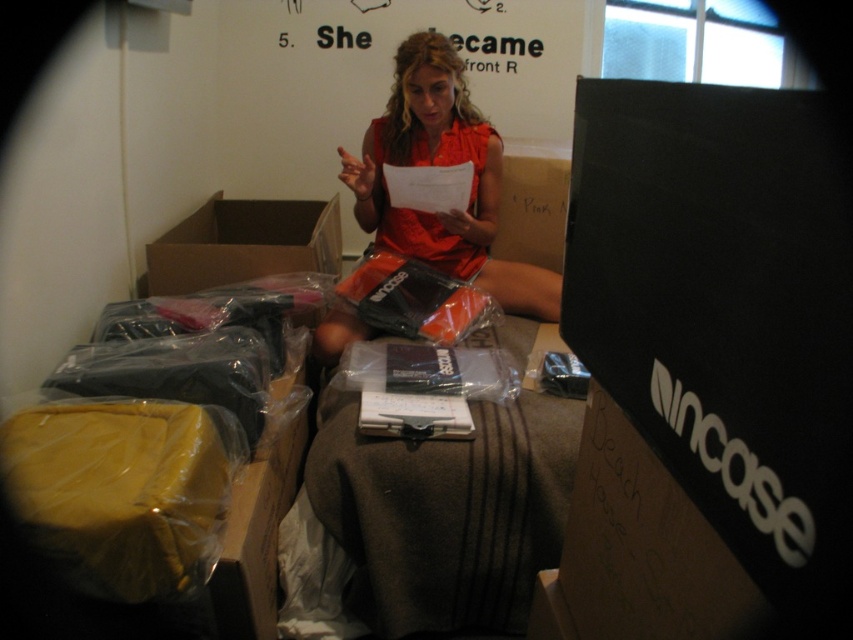
Question: Considering the relative positions of orange matte dress at center and brown cardboard box at upper left in the image provided, where is orange matte dress at center located with respect to brown cardboard box at upper left?

Choices:
 (A) below
 (B) above

Answer: (B)

Question: Which object is closer to the camera taking this photo?

Choices:
 (A) brown cardboard box at upper left
 (B) orange matte dress at center

Answer: (B)

Question: Does orange matte dress at center appear on the right side of brown cardboard box at upper left?

Choices:
 (A) yes
 (B) no

Answer: (A)

Question: Which of the following is the farthest from the observer?

Choices:
 (A) orange matte dress at center
 (B) brown cardboard box at upper left

Answer: (B)

Question: Which of the following is the closest to the observer?

Choices:
 (A) orange matte dress at center
 (B) brown cardboard box at upper left

Answer: (A)

Question: Can you confirm if orange matte dress at center is positioned to the right of brown cardboard box at upper left?

Choices:
 (A) no
 (B) yes

Answer: (B)